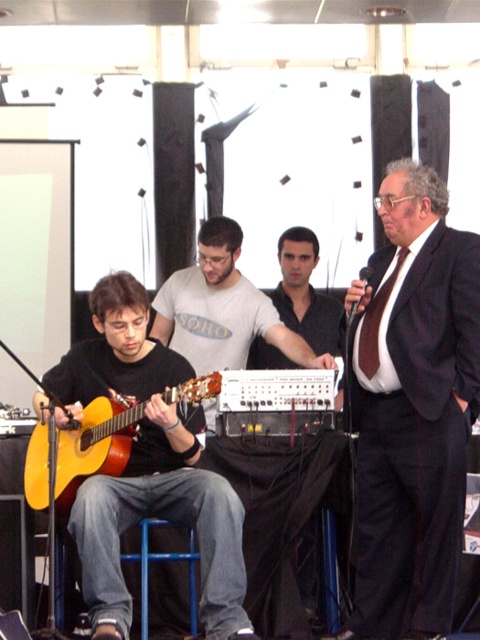
From the picture: You are a photographer positioned in front of the scene. You want to focus on the point at the coordinates that is closer to you. Which coordinate should you choose between point (211, 428) and point (192, 397)?

Point (192, 397) is closer to you than point (211, 428), so you should focus on point (192, 397).

You are a photographer setting up for a live performance. You need to position a light source between the matte gray shirt at center and the acoustic wood guitar at left. Based on their sizes, which object should the light be closer to?

The matte gray shirt at center might be wider than the acoustic wood guitar at left, so the light should be positioned closer to the matte gray shirt at center to ensure proper illumination of the wider object.